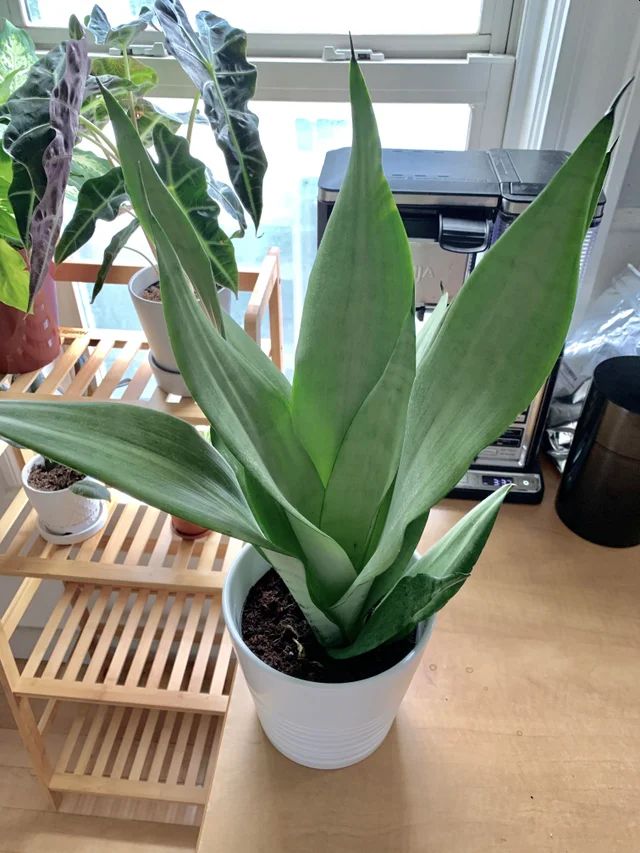
Where is `white window frame`? white window frame is located at coordinates (569, 62).